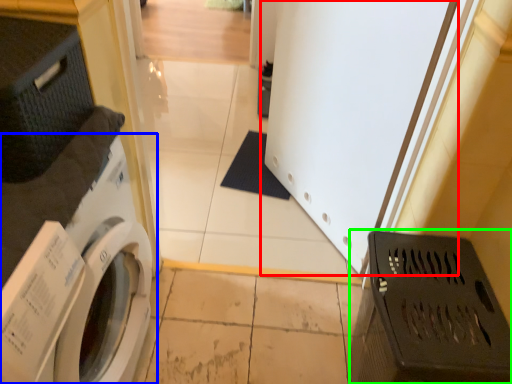
Question: Which object is positioned farthest from screen door (highlighted by a red box)? Select from washing machine (highlighted by a blue box) and laundry basket (highlighted by a green box).

Choices:
 (A) washing machine
 (B) laundry basket

Answer: (A)